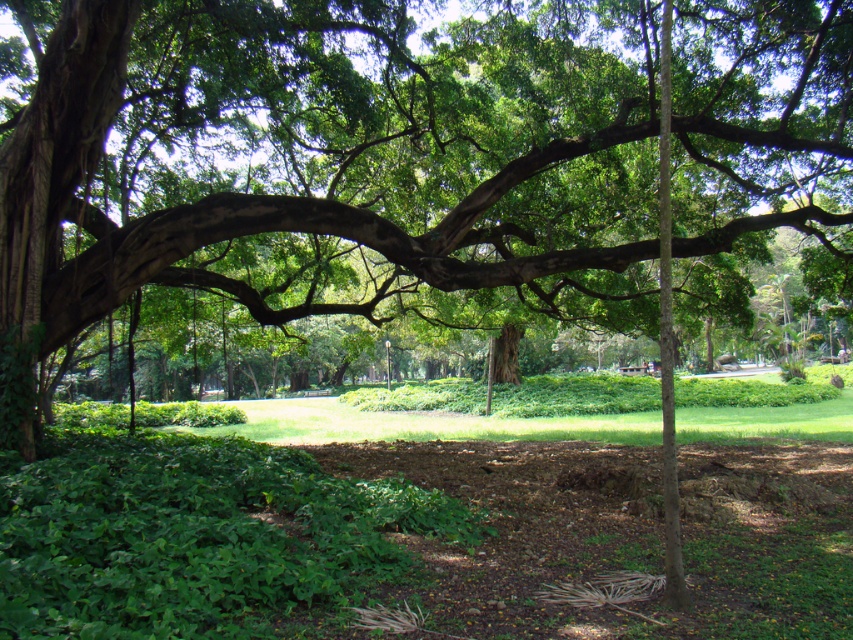
You are standing at the center of the park and want to find the green leafy tree at center. According to the coordinates provided, in which direction should you walk to locate it?

The green leafy tree at center is located at coordinates point (325, 160), so you should walk towards the lower left direction from the center to reach it.

You are standing in the park and want to take a photo of the green leafy tree at center. If your camera has a maximum focus range of 15 feet, will you be able to capture the tree clearly without moving closer?

The green leafy tree at center is 17.31 feet away from the viewer, which exceeds the camera maximum focus range of 15 feet. Therefore, you will not be able to capture the tree clearly without moving closer.

You are standing in the park and want to reach the point marked as point (28, 305). If you walk straight ahead, will you reach it before walking 10 meters?

The point (28, 305) is 8.68 meters away from viewer, so yes, you can reach it before walking 10 meters.